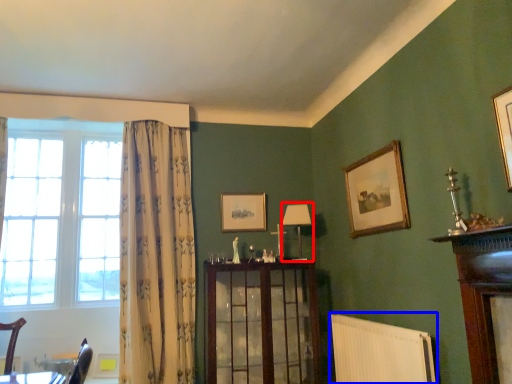
Question: Which object appears closest to the camera in this image, lamp (highlighted by a red box) or radiator (highlighted by a blue box)?

Choices:
 (A) lamp
 (B) radiator

Answer: (B)